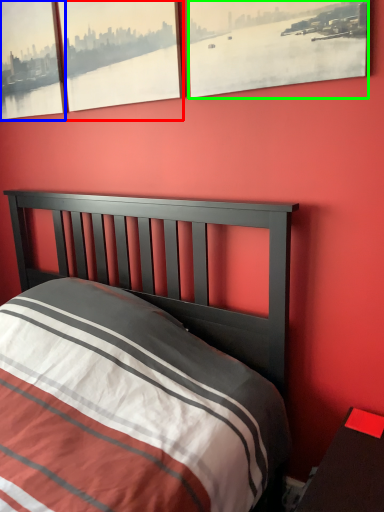
Question: Estimate the real-world distances between objects in this image. Which object is closer to window (highlighted by a red box), window (highlighted by a blue box) or window (highlighted by a green box)?

Choices:
 (A) window
 (B) window

Answer: (A)